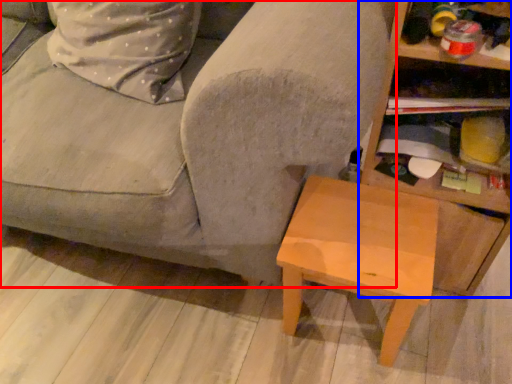
Question: Which object is closer to the camera taking this photo, studio couch (highlighted by a red box) or shelf (highlighted by a blue box)?

Choices:
 (A) studio couch
 (B) shelf

Answer: (A)